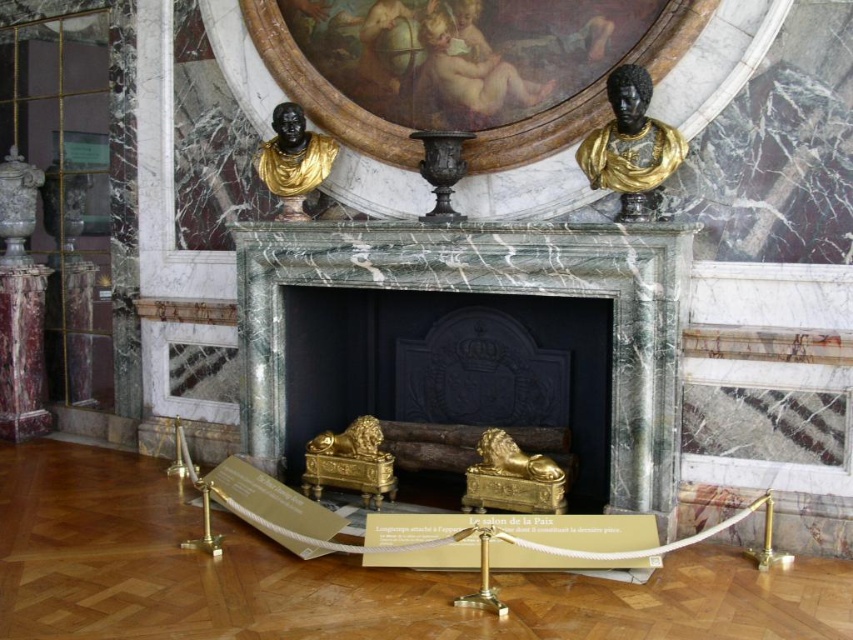
Question: Does black marble bust at upper left have a greater width compared to matte gray vase at upper left?

Choices:
 (A) no
 (B) yes

Answer: (B)

Question: Is black marble bust at upper left wider than matte gray vase at upper left?

Choices:
 (A) no
 (B) yes

Answer: (B)

Question: Which point is closer to the camera taking this photo?

Choices:
 (A) (282, 164)
 (B) (670, 134)
 (C) (36, 172)
 (D) (596, 273)

Answer: (B)

Question: Is green marble fireplace at center wider than black marble bust at upper right?

Choices:
 (A) yes
 (B) no

Answer: (A)

Question: Which of the following is the closest to the observer?

Choices:
 (A) (12, 188)
 (B) (575, 157)
 (C) (322, 170)
 (D) (648, 401)

Answer: (D)

Question: Which is farther from the matte gray vase at upper left?

Choices:
 (A) green marble fireplace at center
 (B) black marble bust at upper right

Answer: (B)